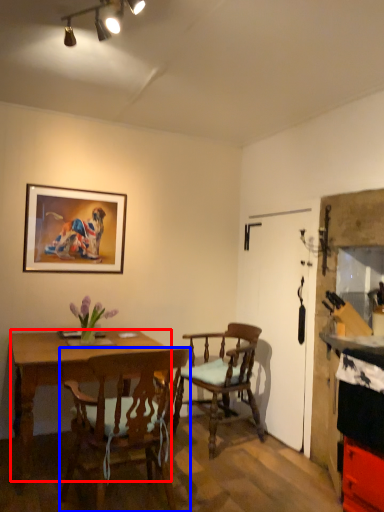
Question: Among these objects, which one is nearest to the camera, desk (highlighted by a red box) or chair (highlighted by a blue box)?

Choices:
 (A) desk
 (B) chair

Answer: (B)